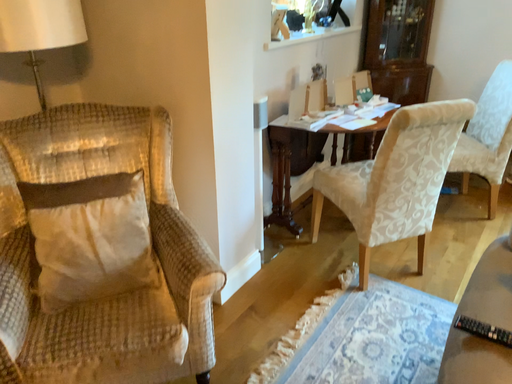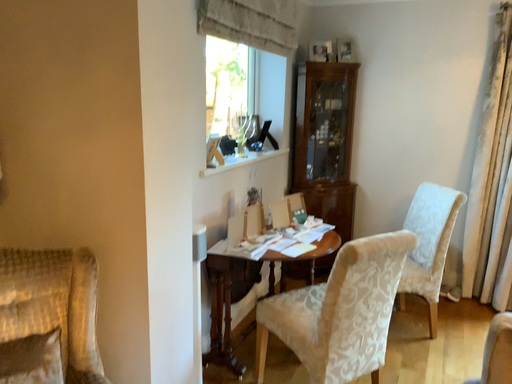
Question: Which way did the camera rotate in the video?

Choices:
 (A) rotated left
 (B) rotated right

Answer: (B)